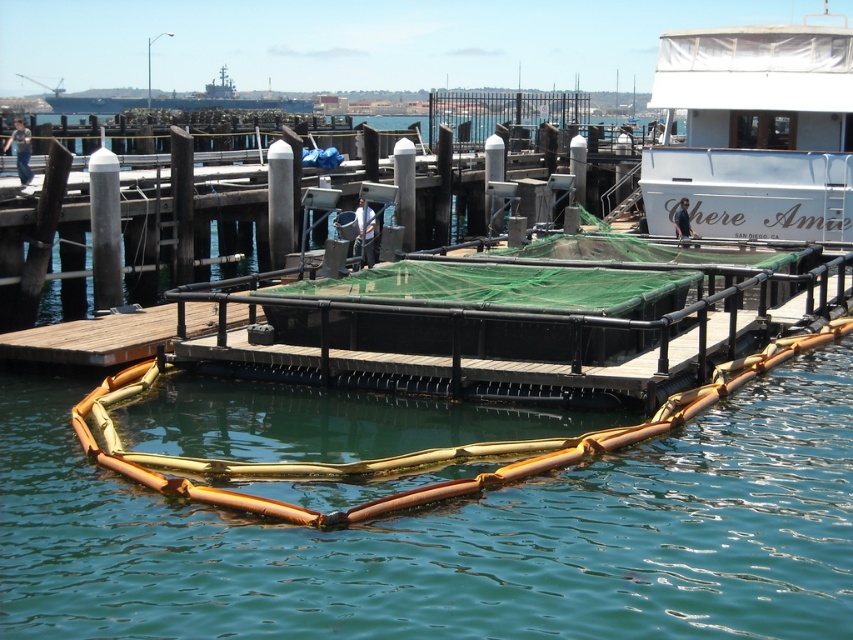
You are a boat operator who needs to secure the white matte boat at upper right to the dock. The brown rubber barrier at center is in the way. Can you move the barrier to the side to make space?

The brown rubber barrier at center is positioned under the white matte boat at upper right, so you cannot move the barrier without first moving or adjusting the boat.

You are a marine biologist observing the waterfront scene. You need to place a sensor at the exact center of the brown rubber barrier at center. According to the coordinates provided, where should you place the sensor?

The sensor should be placed at the coordinates point (457, 538) since that is the exact center of the brown rubber barrier at center as specified.

You are a marine biologist planning to secure a research vessel. You have a white matte boat at upper right and a brown rubber barrier at center. Which object is wider, and how does this affect anchoring the boat?

The brown rubber barrier at center is wider than the white matte boat at upper right. This means the barrier may require more space when anchoring the boat to ensure stability and avoid obstruction.